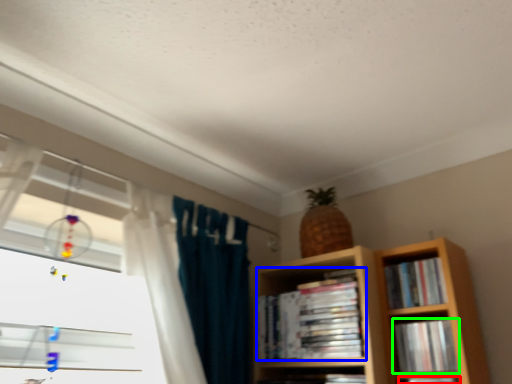
Question: Considering the real-world distances, which object is farthest from book (highlighted by a red box)? book (highlighted by a blue box) or book (highlighted by a green box)?

Choices:
 (A) book
 (B) book

Answer: (A)